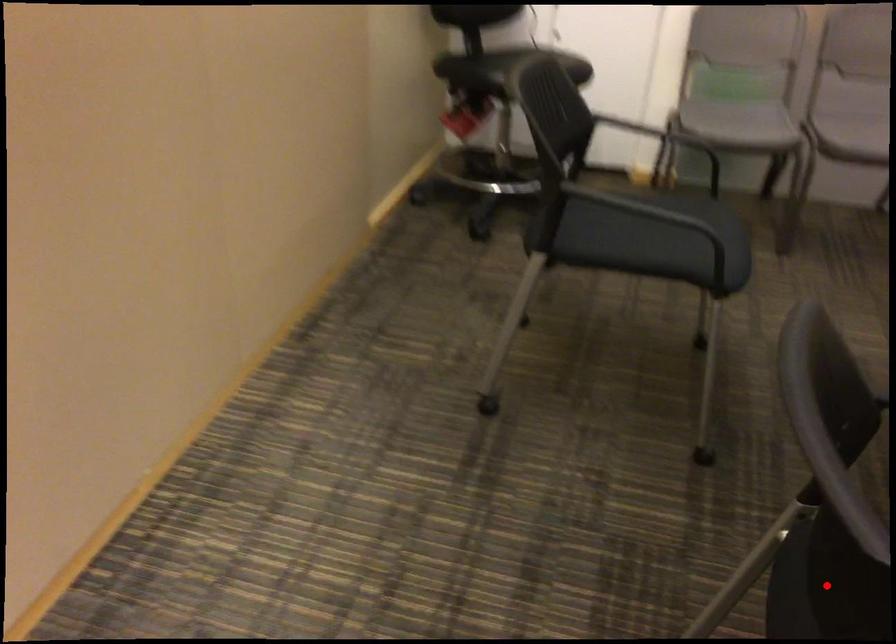
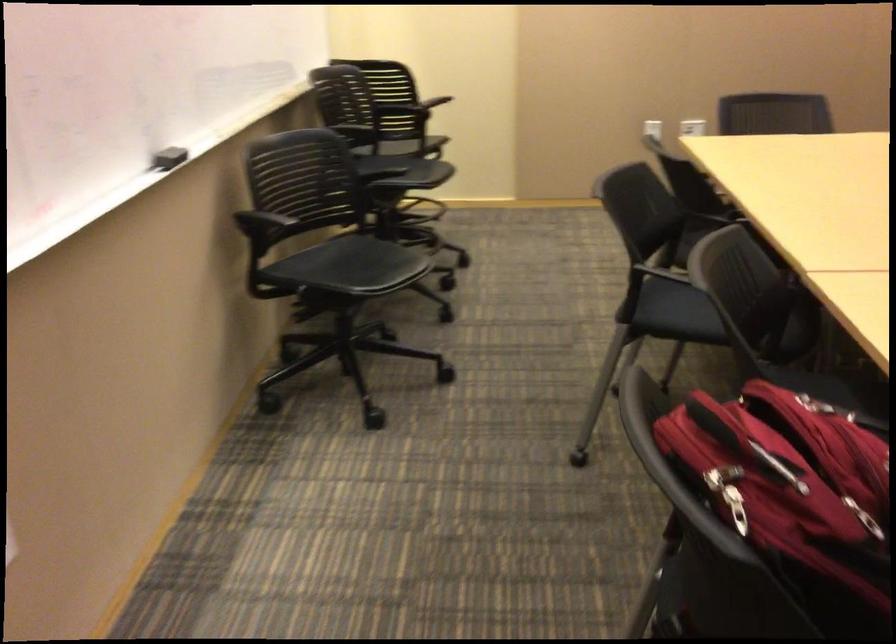
Question: I am providing you with two images of the same scene from different viewpoints. A red point is marked on the first image. At the location where the point appears in image 1, is it still visible in image 2?

Choices:
 (A) Yes
 (B) No

Answer: (B)